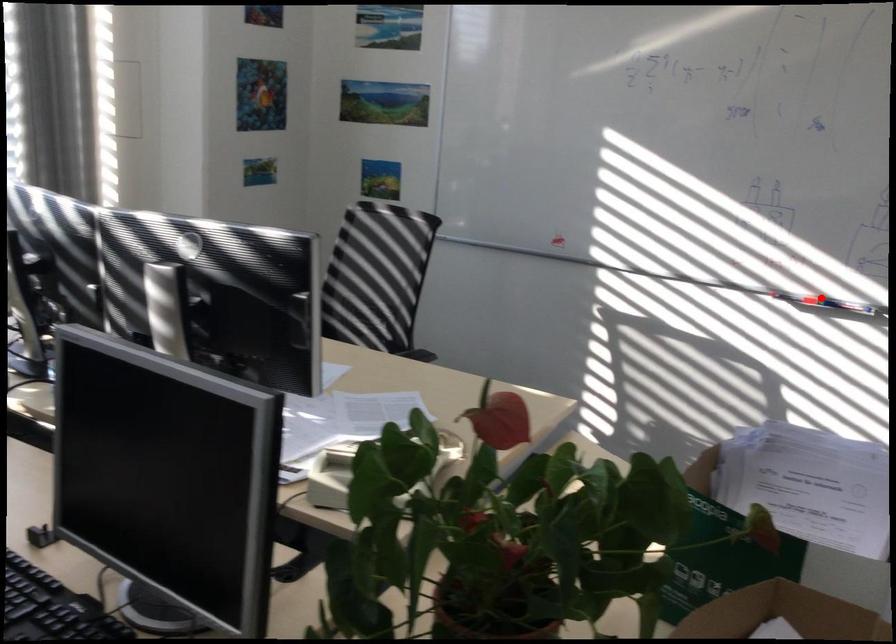
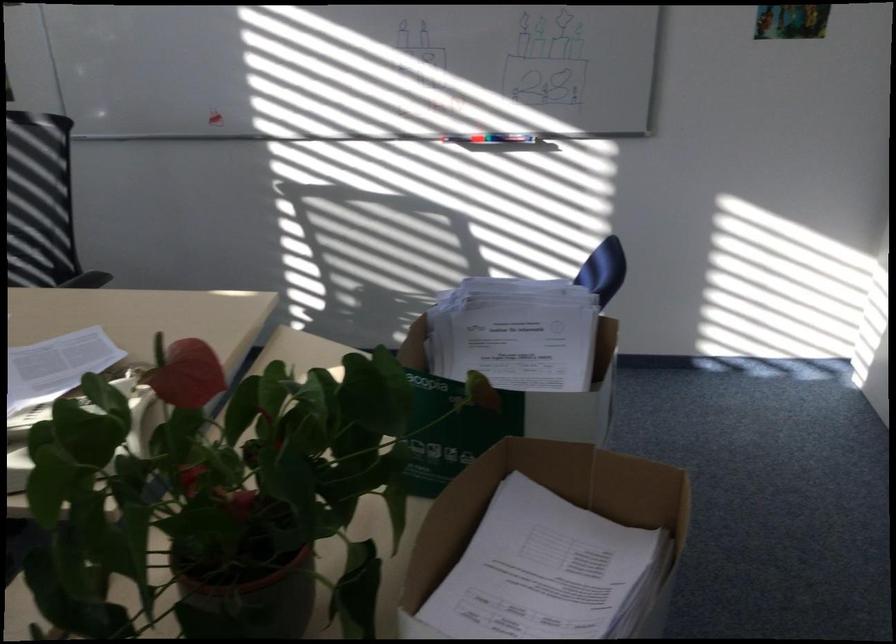
The point at the highlighted location is marked in the first image. Where is the corresponding point in the second image?

(488, 138)